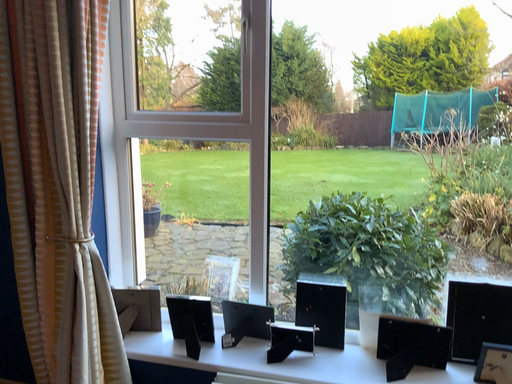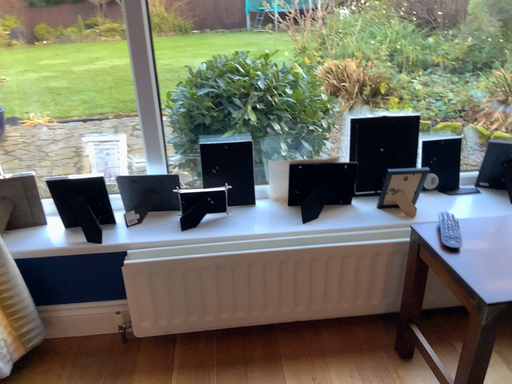
Question: How did the camera likely rotate when shooting the video?

Choices:
 (A) rotated upward
 (B) rotated downward

Answer: (B)